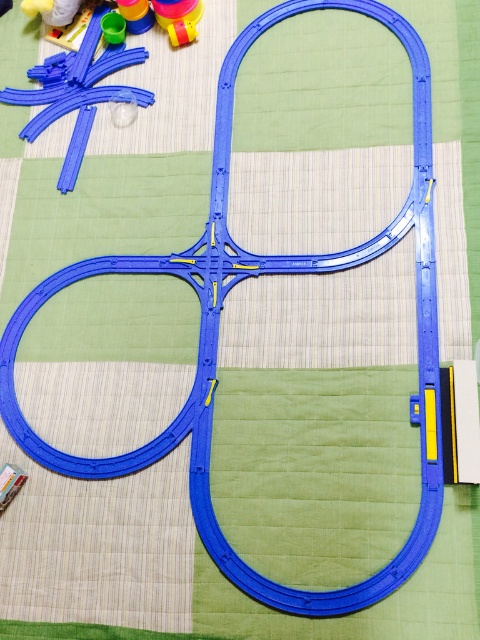
You are a child trying to place a toy car at point [32,136]. The toy car is 1.2 meters long. Will it fit between the two points?

The distance between the two points is 1.28 meters, so the toy car which is 1.2 meters long will fit between them.

You are a child trying to stack the translucent yellow cup at upper left onto the matte plastic track at upper left. Based on their sizes, will the cup fit over the track?

The matte plastic track at upper left is wider than the translucent yellow cup at upper left, so the cup will not fit over the track since it is narrower than the track.

You are setting up a toy train layout and need to place the rubberized yellow cup at upper left exactly at coordinate point 0.016, 0.108. Can you confirm if this placement is within the visible area of the image?

The rubberized yellow cup at upper left is already positioned at point (51, 10), so its placement is within the visible area of the image.